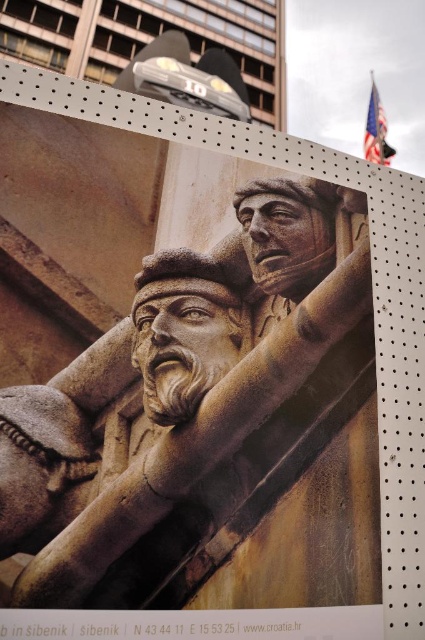
Question: Among these objects, which one is farthest from the camera?

Choices:
 (A) carved stone man at center
 (B) rustic stone sculpture at center

Answer: (A)

Question: From the image, what is the correct spatial relationship of rustic stone sculpture at center in relation to carved stone man at center?

Choices:
 (A) left
 (B) right

Answer: (B)

Question: Which object appears closest to the camera in this image?

Choices:
 (A) carved stone man at center
 (B) rustic stone sculpture at center

Answer: (B)

Question: Is rustic stone sculpture at center smaller than carved stone man at center?

Choices:
 (A) no
 (B) yes

Answer: (A)

Question: Does rustic stone sculpture at center appear on the right side of carved stone man at center?

Choices:
 (A) yes
 (B) no

Answer: (A)